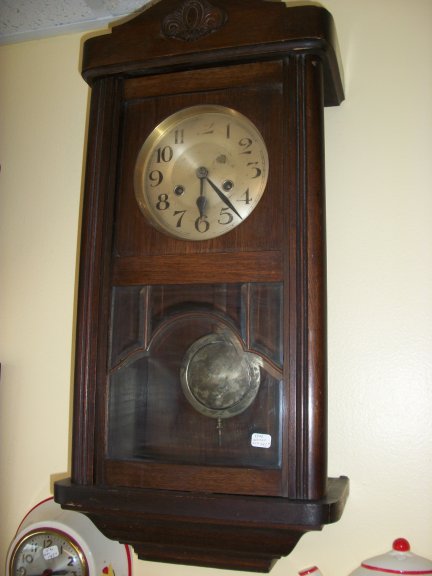
This screenshot has width=432, height=576. Find the location of `empty space background wall`. empty space background wall is located at coordinates (362, 237), (30, 439).